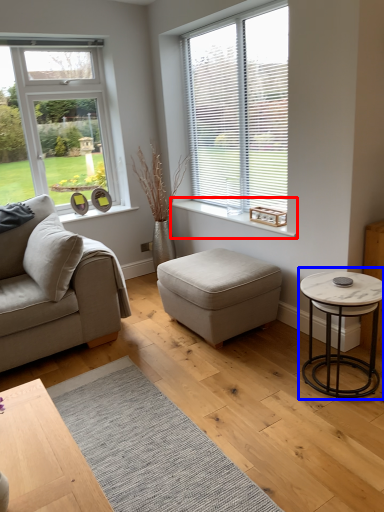
Question: Among these objects, which one is nearest to the camera, window sill (highlighted by a red box) or coffee table (highlighted by a blue box)?

Choices:
 (A) window sill
 (B) coffee table

Answer: (B)